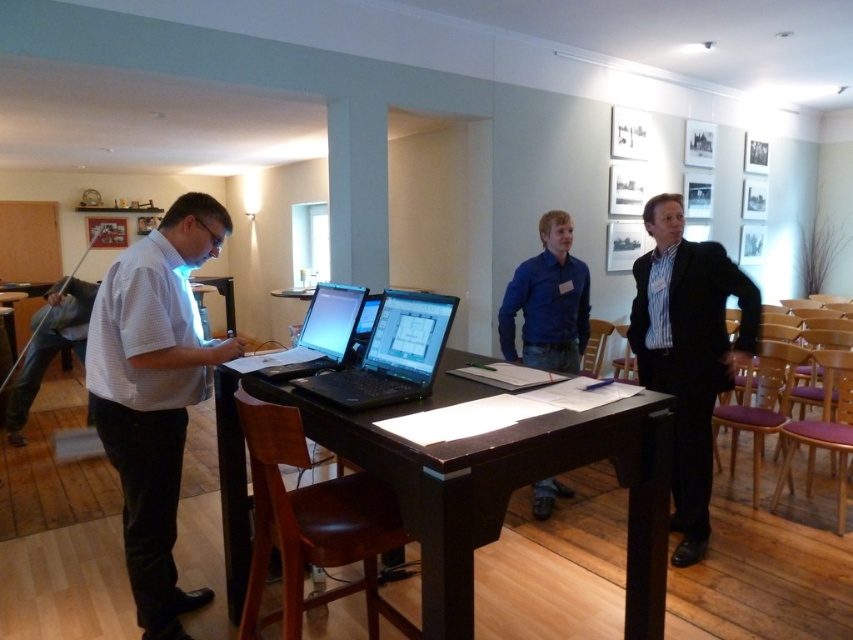
Consider the image. You are a photographer in the room and want to take a photo of the two people wearing the white checkered shirt at center and striped cotton shirt at center. Which one should you focus on first if you want to capture both in the same frame without moving the camera?

The white checkered shirt at center is shorter than the striped cotton shirt at center, so you should focus on the white checkered shirt at center first to ensure both are in the frame.

You are organizing a photo shoot and need to ensure that the white checkered shirt at center and the striped cotton shirt at center are positioned properly. Based on the scene, which shirt should be placed to the left to ensure they don not overlap?

The striped cotton shirt at center should be placed to the left of the white checkered shirt at center since the white checkered shirt at center is wider and might overlap if placed to the left.